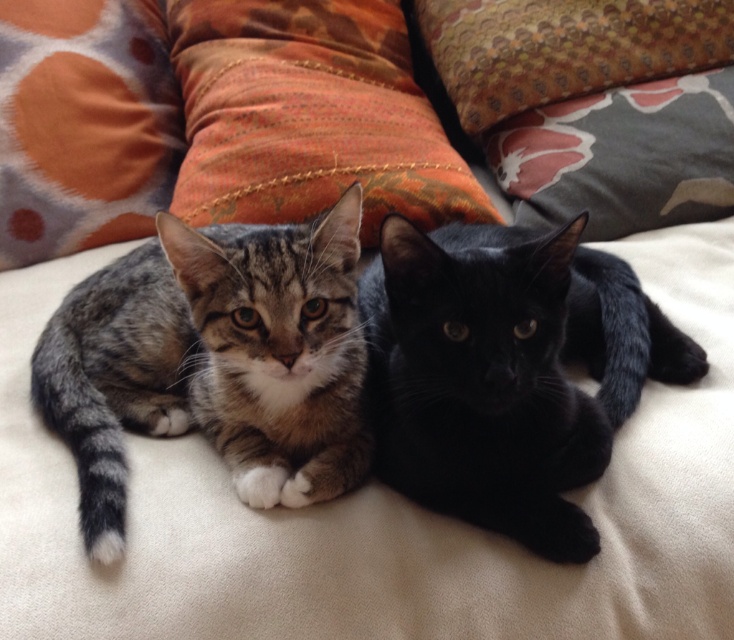
You are a photographer trying to focus on two points in the image. The first point is point (277, 230) and the second is point (566, 118). Which point is closer to you?

Point (277, 230) is closer to the viewer than point (566, 118).

You are holding a 30 inch long pole and want to reach a point located at point (x=509, y=484). Can you reach it with the pole?

The distance between you and point (x=509, y=484) is 36.87 inches. Since your pole is 30 inches long, you cannot reach the point with the pole.